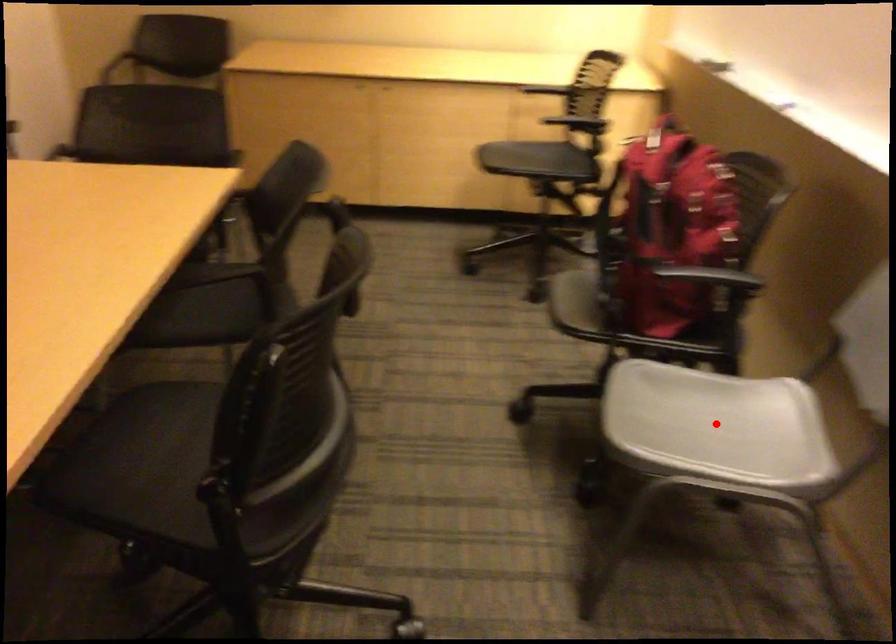
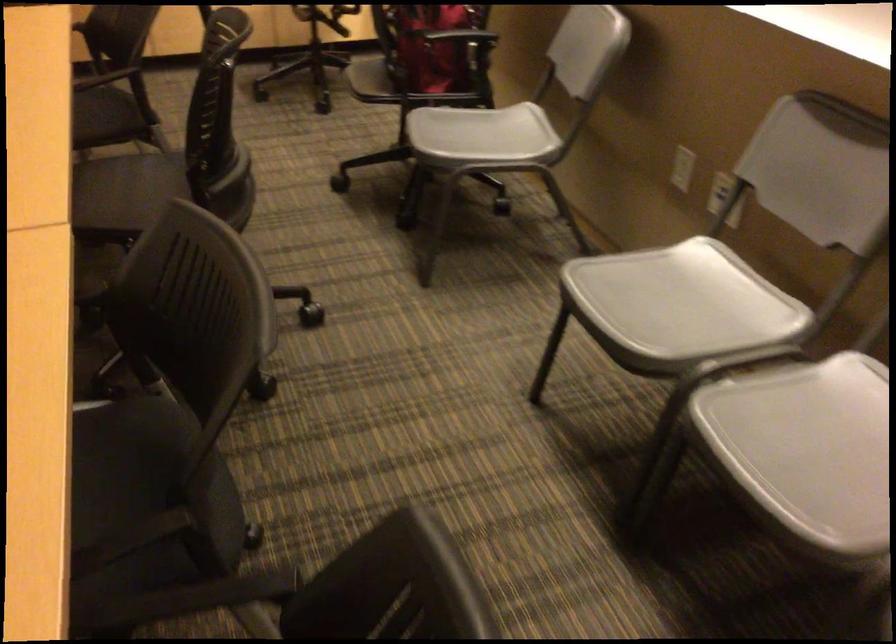
Where in the second image is the point corresponding to the highlighted location from the first image?

(481, 136)